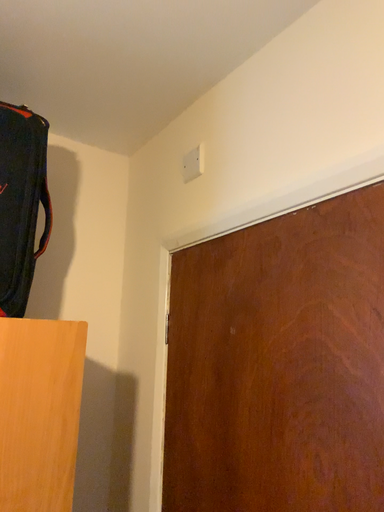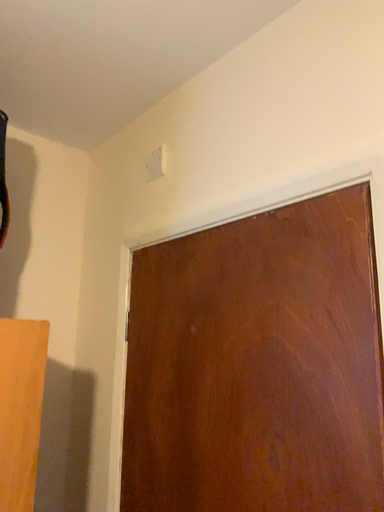
Question: Which way did the camera rotate in the video?

Choices:
 (A) rotated right
 (B) rotated left

Answer: (A)